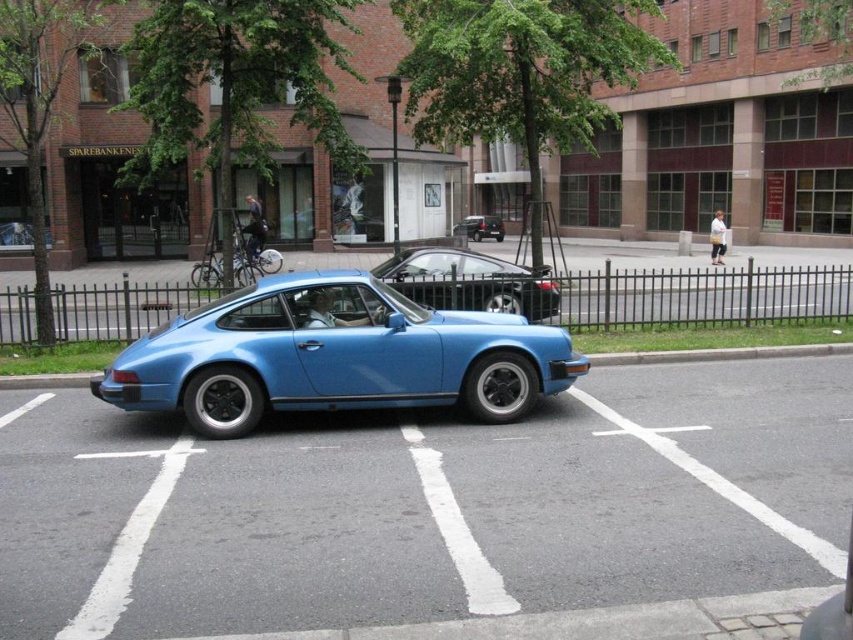
Who is more forward, [305,330] or [474,214]?

Point [305,330] is in front.

The height and width of the screenshot is (640, 853). I want to click on satin blue car at center, so click(335, 355).

Can you confirm if shiny black car at center is smaller than metallic silver car at center?

Correct, shiny black car at center occupies less space than metallic silver car at center.

Which is more to the left, shiny black car at center or metallic silver car at center?

Positioned to the left is shiny black car at center.

The height and width of the screenshot is (640, 853). Find the location of `shiny black car at center`. shiny black car at center is located at coordinates (469, 282).

Can you confirm if satin blue car at center is positioned above shiny black car at center?

No, satin blue car at center is not above shiny black car at center.

Who is more distant from viewer, (289, 388) or (534, 278)?

Point (534, 278)

You are a GUI agent. You are given a task and a screenshot of the screen. Output one action in this format:
    pyautogui.click(x=<x>, y=<y>)
    Task: Click on the satin blue car at center
    The height and width of the screenshot is (640, 853).
    Given the screenshot: What is the action you would take?
    [x=335, y=355]